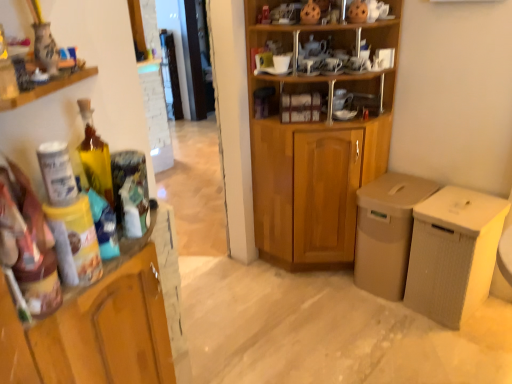
Question: Is wooden cabinet at center situated inside wooden cupboard at center or outside?

Choices:
 (A) outside
 (B) inside

Answer: (B)

Question: Considering the positions of wooden cabinet at center and wooden cupboard at center in the image, is wooden cabinet at center wider or thinner than wooden cupboard at center?

Choices:
 (A) thin
 (B) wide

Answer: (A)

Question: Estimate the real-world distances between objects in this image. Which object is closer to the wooden cupboard at center?

Choices:
 (A) matte ceramic vase at upper left
 (B) wooden cabinet at center
 (C) translucent glass bottle at left

Answer: (B)

Question: Considering the real-world distances, which object is farthest from the wooden cupboard at center?

Choices:
 (A) wooden cabinet at center
 (B) translucent glass bottle at left
 (C) matte ceramic vase at upper left

Answer: (C)